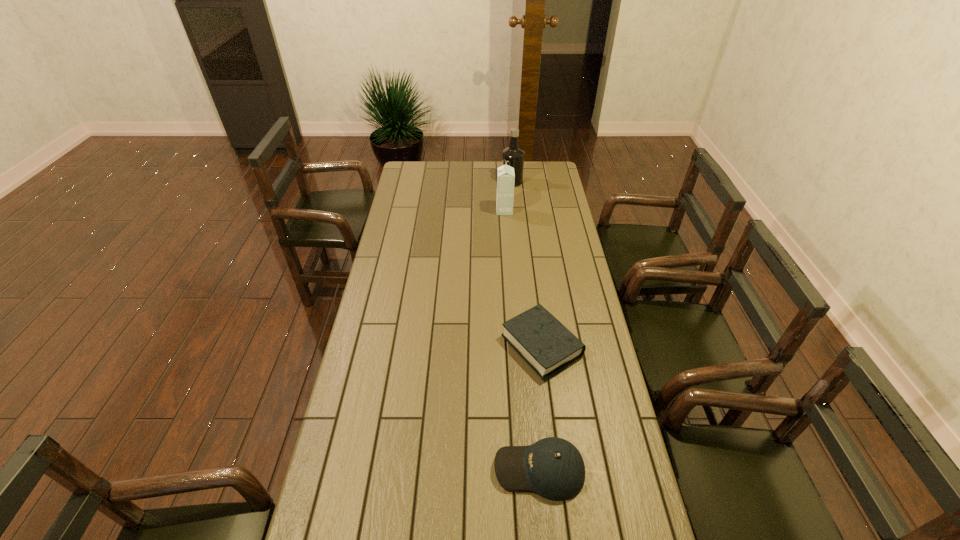
Locate an element on the screen. the farthest object is located at coordinates (513, 156).

Where is `liquor`? liquor is located at coordinates (513, 156).

Find the location of `the second farthest object`. the second farthest object is located at coordinates (505, 174).

Identify the location of the third shortest object. This screenshot has width=960, height=540. tap(505, 174).

Find the location of `baseball cap`. baseball cap is located at coordinates (552, 467).

Locate an element on the screen. This screenshot has width=960, height=540. the nearest object is located at coordinates (552, 467).

In order to click on the third farthest object in this screenshot , I will do `click(537, 336)`.

The height and width of the screenshot is (540, 960). What are the coordinates of `Bible` in the screenshot? It's located at (537, 336).

The width and height of the screenshot is (960, 540). In order to click on vacant space located 0.250m on the front label of the liquor in this screenshot , I will do `click(454, 181)`.

The image size is (960, 540). Identify the location of vacant area situated on the front label of the liquor. (434, 181).